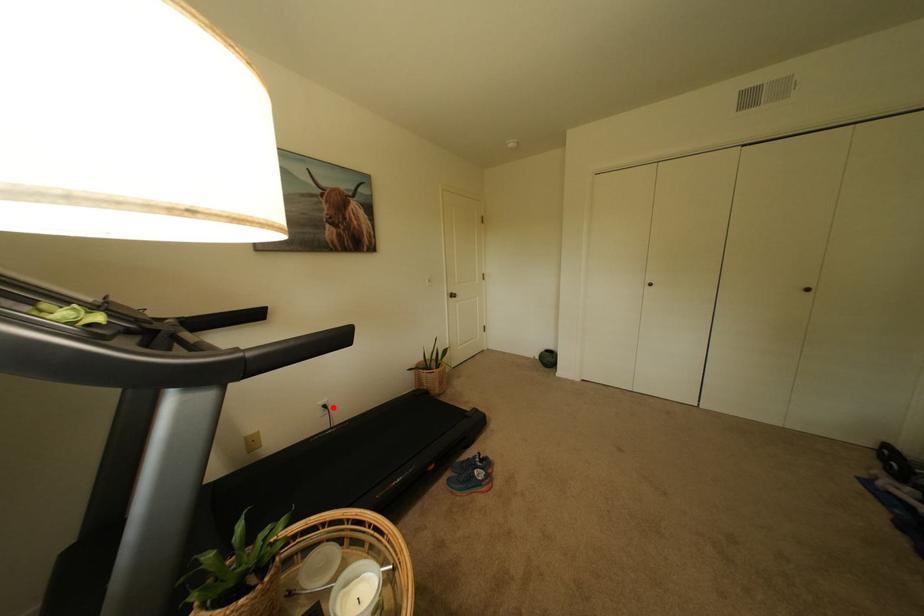
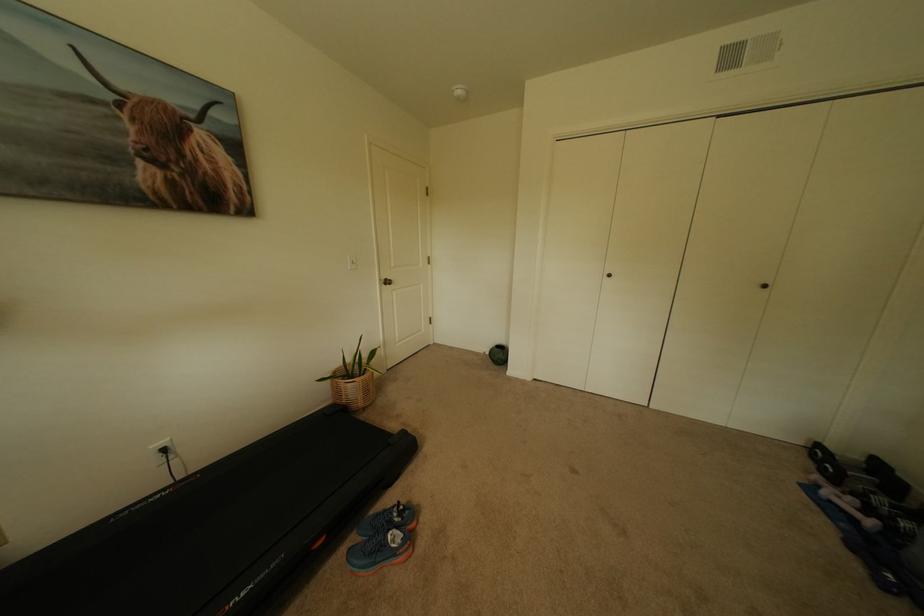
In the second image, find the point that corresponds to the highlighted location in the first image.

(173, 451)